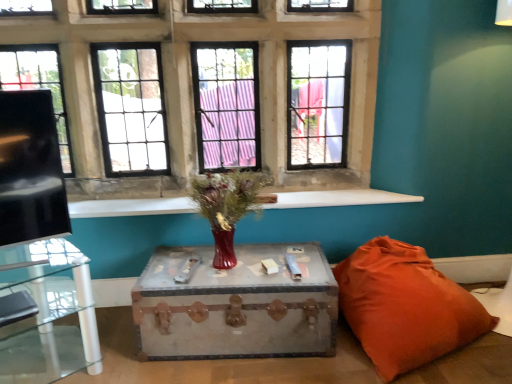
Locate an element on the screen. The image size is (512, 384). vacant space underneath clear glass table at left, which is counted as the first table, starting from the left (from a real-world perspective) is located at coordinates (46, 362).